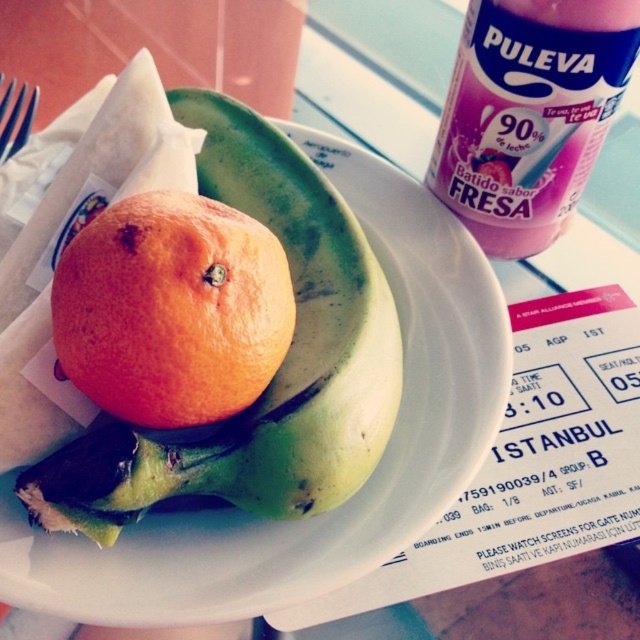
Question: Does green matte banana at center appear over orangesmoothobject at center?

Choices:
 (A) yes
 (B) no

Answer: (A)

Question: Which point is closer to the camera?

Choices:
 (A) orangesmoothobject at center
 (B) blue plastic fork at upper left
 (C) green matte banana at center
 (D) pink plastic can at upper right

Answer: (A)

Question: Which object appears farthest from the camera in this image?

Choices:
 (A) orangesmoothobject at center
 (B) pink plastic can at upper right
 (C) blue plastic fork at upper left
 (D) green matte banana at center

Answer: (C)

Question: Is green matte banana at center below orangesmoothobject at center?

Choices:
 (A) no
 (B) yes

Answer: (A)

Question: From the image, what is the correct spatial relationship of green matte banana at center in relation to orangesmoothobject at center?

Choices:
 (A) below
 (B) above

Answer: (B)

Question: Among these objects, which one is farthest from the camera?

Choices:
 (A) blue plastic fork at upper left
 (B) pink plastic can at upper right
 (C) orangesmoothobject at center

Answer: (A)